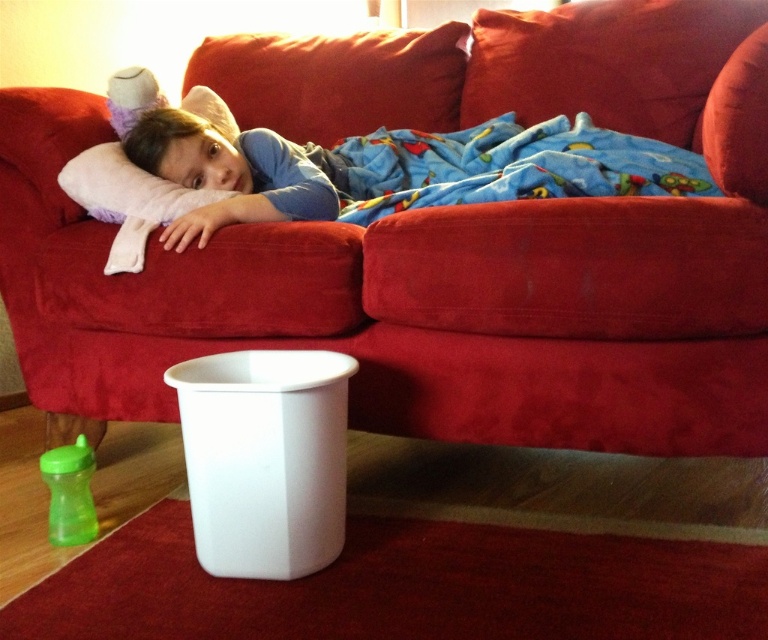
Does purple soft pillow at upper left have a larger size compared to green plastic sippy cup at lower left?

Yes.

Find the location of a particular element. The width and height of the screenshot is (768, 640). purple soft pillow at upper left is located at coordinates pyautogui.click(x=126, y=189).

Who is lower down, blue fleece blanket at upper center or green plastic sippy cup at lower left?

Positioned lower is green plastic sippy cup at lower left.

Is point (389, 188) more distant than point (50, 483)?

Yes, point (389, 188) is behind point (50, 483).

Locate an element on the screen. This screenshot has height=640, width=768. blue fleece blanket at upper center is located at coordinates (508, 166).

Can you confirm if velvet red couch at upper center is thinner than blue fleece blanket at upper center?

Incorrect, velvet red couch at upper center's width is not less than blue fleece blanket at upper center's.

Is point (614, 100) closer to viewer compared to point (439, 157)?

No.

Find the location of a particular element. velvet red couch at upper center is located at coordinates (435, 243).